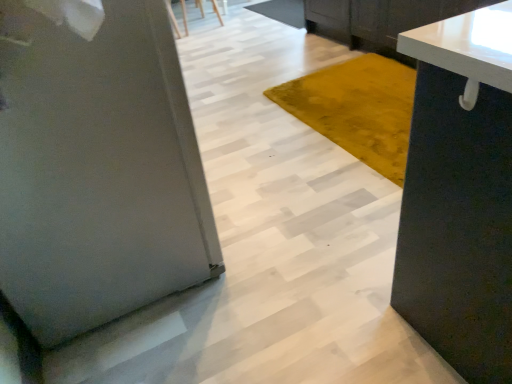
Question: Can you confirm if satin silver refrigerator at left is shorter than wooden chair at upper center?

Choices:
 (A) yes
 (B) no

Answer: (B)

Question: Is satin silver refrigerator at left to the left of wooden chair at upper center from the viewer's perspective?

Choices:
 (A) yes
 (B) no

Answer: (A)

Question: Are satin silver refrigerator at left and wooden chair at upper center far apart?

Choices:
 (A) no
 (B) yes

Answer: (B)

Question: From a real-world perspective, is satin silver refrigerator at left positioned over wooden chair at upper center based on gravity?

Choices:
 (A) no
 (B) yes

Answer: (B)

Question: Can you see satin silver refrigerator at left touching wooden chair at upper center?

Choices:
 (A) yes
 (B) no

Answer: (B)

Question: Could you tell me if satin silver refrigerator at left is turned towards wooden chair at upper center?

Choices:
 (A) no
 (B) yes

Answer: (A)

Question: Does wooden chair at upper center have a lesser height compared to satin silver refrigerator at left?

Choices:
 (A) no
 (B) yes

Answer: (B)

Question: Is wooden chair at upper center to the left of satin silver refrigerator at left from the viewer's perspective?

Choices:
 (A) yes
 (B) no

Answer: (B)

Question: Are wooden chair at upper center and satin silver refrigerator at left located far from each other?

Choices:
 (A) yes
 (B) no

Answer: (A)

Question: Is wooden chair at upper center in front of satin silver refrigerator at left?

Choices:
 (A) no
 (B) yes

Answer: (A)

Question: From a real-world perspective, is wooden chair at upper center under satin silver refrigerator at left?

Choices:
 (A) no
 (B) yes

Answer: (B)

Question: Is wooden chair at upper center taller than satin silver refrigerator at left?

Choices:
 (A) no
 (B) yes

Answer: (A)

Question: Can you confirm if white glossy countertop at upper right is bigger than wooden chair at upper center?

Choices:
 (A) yes
 (B) no

Answer: (A)